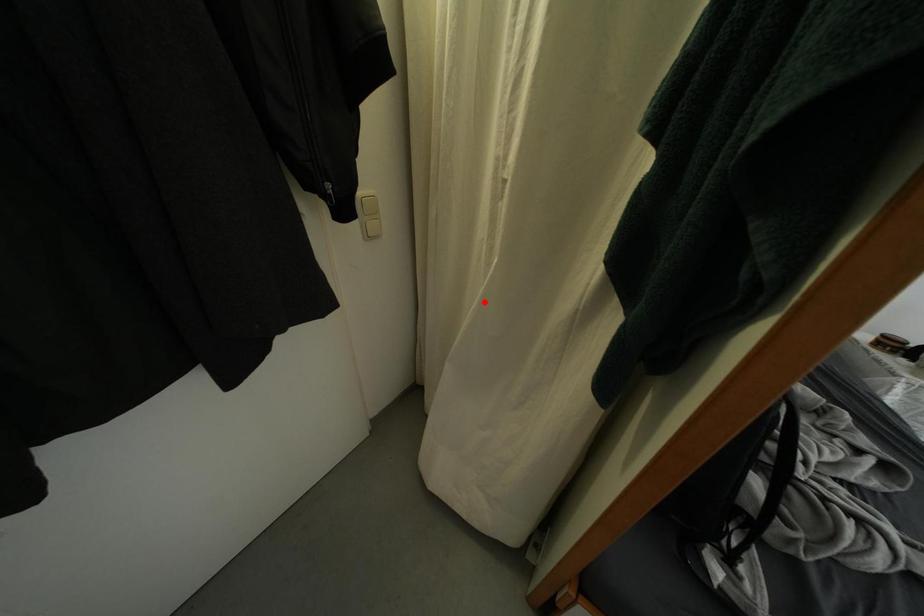
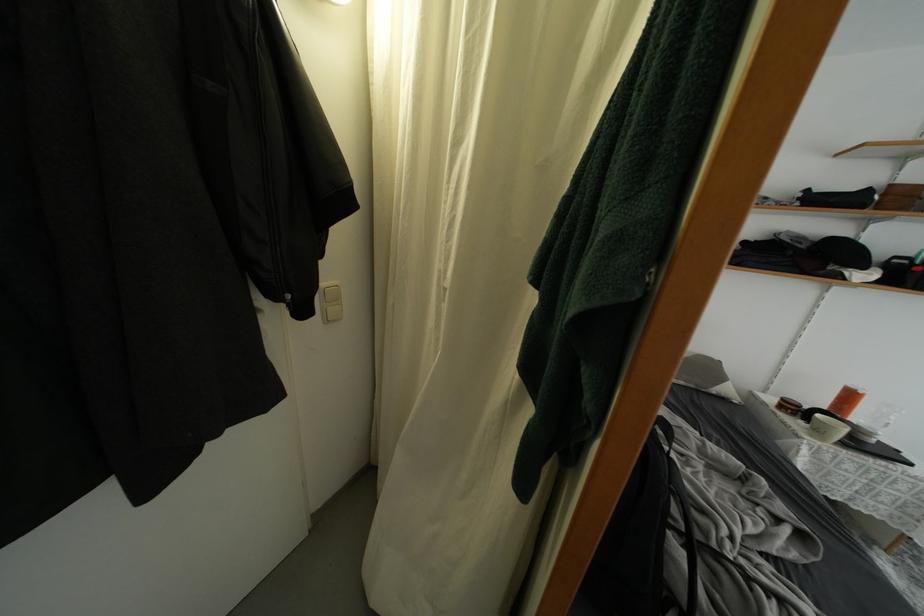
Where in the second image is the point corresponding to the highlighted location from the first image?

(432, 387)